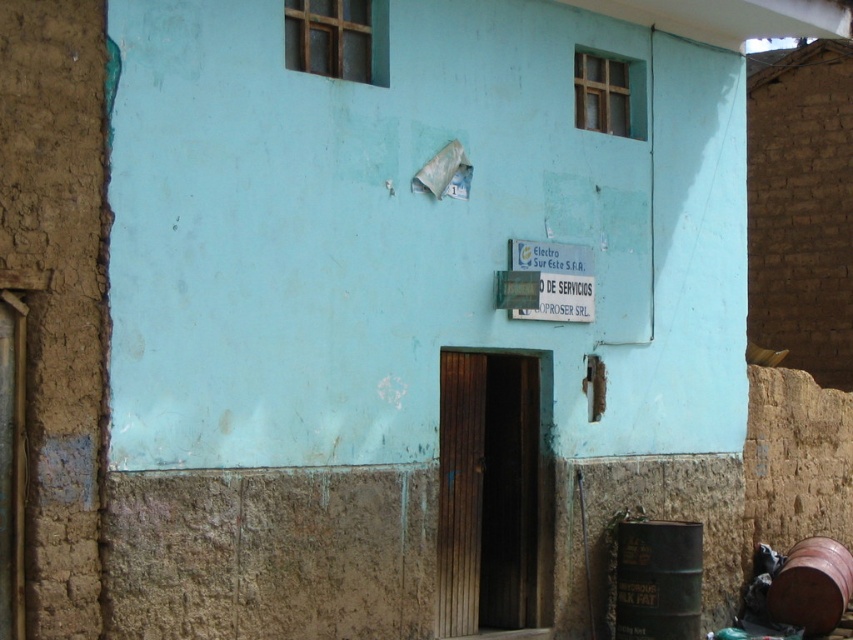
Question: Is green metallic barrel at lower right further to the viewer compared to brown matte barrel at lower right?

Choices:
 (A) no
 (B) yes

Answer: (A)

Question: Which point is closer to the camera taking this photo?

Choices:
 (A) (804, 611)
 (B) (659, 605)

Answer: (B)

Question: Is green metallic barrel at lower right below brown matte barrel at lower right?

Choices:
 (A) no
 (B) yes

Answer: (A)

Question: Which of the following is the closest to the observer?

Choices:
 (A) brown matte barrel at lower right
 (B) green metallic barrel at lower right

Answer: (B)

Question: Which point is closer to the camera?

Choices:
 (A) 672,572
 (B) 844,592

Answer: (A)

Question: Is green metallic barrel at lower right to the left of brown matte barrel at lower right from the viewer's perspective?

Choices:
 (A) no
 (B) yes

Answer: (B)